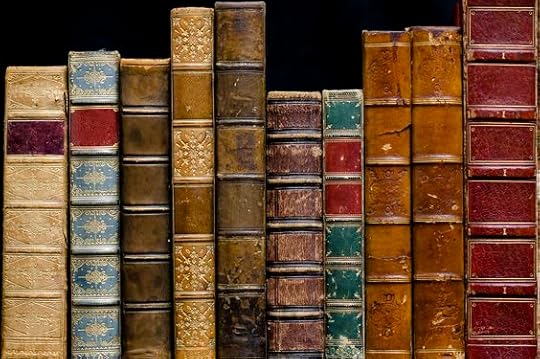
Identify the location of books. (31, 207), (92, 221), (150, 231), (198, 219), (246, 204), (291, 212), (429, 210), (397, 224), (511, 200), (340, 218).